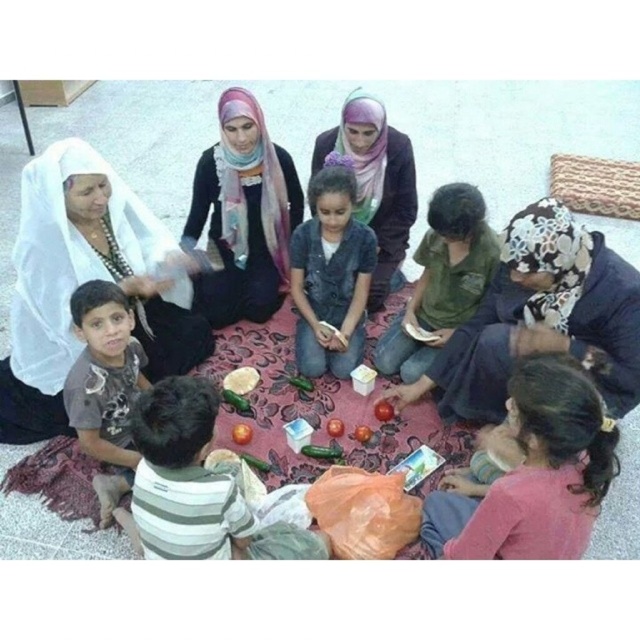
Does shiny red tomato at center have a larger size compared to red matte apple at center?

Yes, shiny red tomato at center is bigger than red matte apple at center.

Which is more to the right, shiny red tomato at center or red matte apple at center?

Positioned to the right is shiny red tomato at center.

Measure the distance between shiny red tomato at center and camera.

shiny red tomato at center and camera are 2.87 meters apart from each other.

Image resolution: width=640 pixels, height=640 pixels. What are the coordinates of `shiny red tomato at center` in the screenshot? It's located at (384, 410).

Is floral-patterned fabric at lower right closer to the viewer compared to dark brown cotton shirt at lower left?

Yes, it is in front of dark brown cotton shirt at lower left.

Who is more forward, (x=627, y=316) or (x=84, y=390)?

Point (x=627, y=316)

At what (x,y) coordinates should I click in order to perform the action: click on floral-patterned fabric at lower right. Please return your answer as a coordinate pair (x, y). Looking at the image, I should click on (540, 317).

In order to click on floral-patterned fabric at lower right in this screenshot , I will do `click(540, 317)`.

Find the location of a particular element. denim shirt at center is located at coordinates (330, 276).

Looking at this image, measure the distance between denim shirt at center and camera.

A distance of 2.85 meters exists between denim shirt at center and camera.

In order to click on denim shirt at center in this screenshot , I will do `click(330, 276)`.